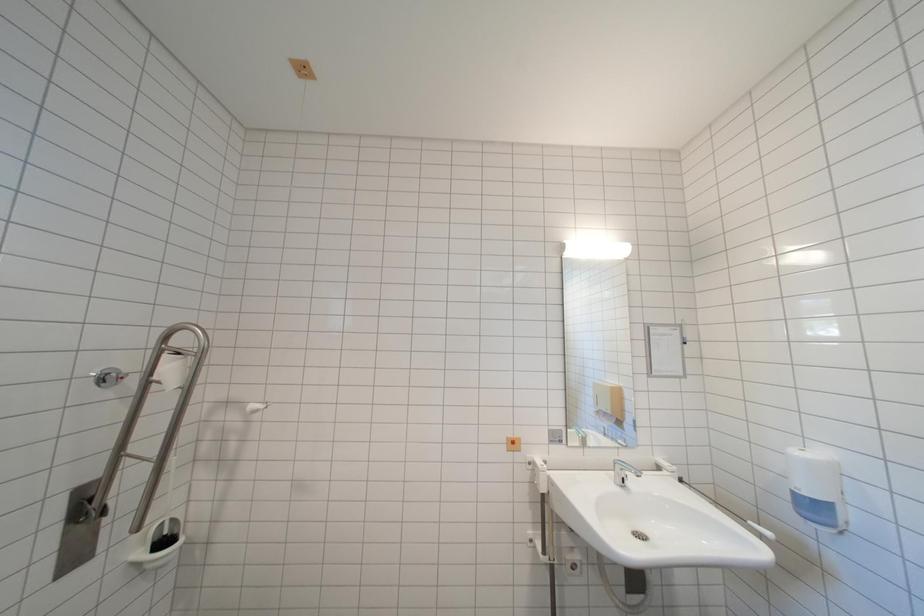
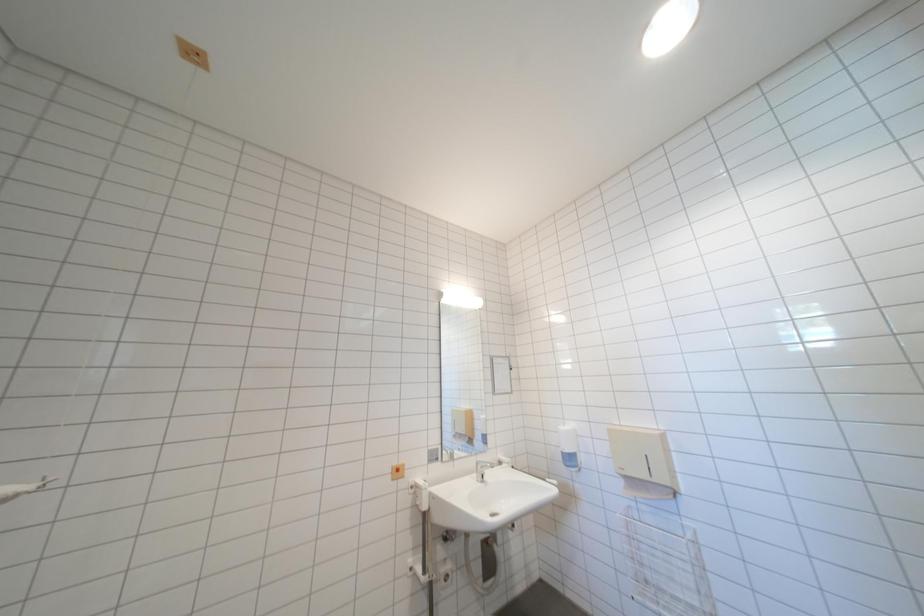
Question: Based on the continuous images, in which direction is the camera rotating? Reply with the corresponding letter.

Choices:
 (A) Left
 (B) Right
 (C) Up
 (D) Down

Answer: (B)